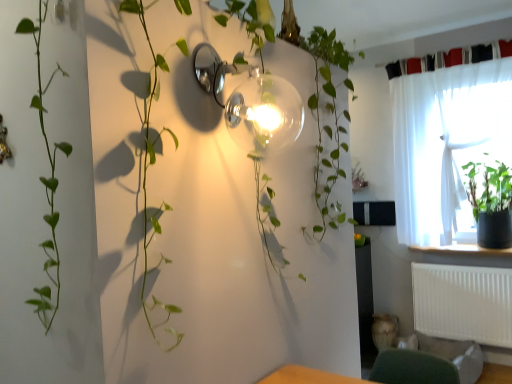
Question: Would you say black fabric curtain at upper right, which ranks as the second curtain in bottom-to-top order, is outside white sheer curtain at upper right, which is the 1th curtain from bottom to top?

Choices:
 (A) yes
 (B) no

Answer: (B)

Question: Considering the relative sizes of black fabric curtain at upper right, which ranks as the second curtain in bottom-to-top order, and white sheer curtain at upper right, which is the 1th curtain from bottom to top, in the image provided, is black fabric curtain at upper right, which ranks as the second curtain in bottom-to-top order, taller than white sheer curtain at upper right, which is the 1th curtain from bottom to top,?

Choices:
 (A) no
 (B) yes

Answer: (A)

Question: Is black fabric curtain at upper right, which ranks as the second curtain in bottom-to-top order, in front of white sheer curtain at upper right, which ranks as the 2th curtain in top-to-bottom order?

Choices:
 (A) yes
 (B) no

Answer: (B)

Question: Considering the relative sizes of black fabric curtain at upper right, which is counted as the first curtain, starting from the top, and white sheer curtain at upper right, which ranks as the 2th curtain in top-to-bottom order, in the image provided, is black fabric curtain at upper right, which is counted as the first curtain, starting from the top, bigger than white sheer curtain at upper right, which ranks as the 2th curtain in top-to-bottom order,?

Choices:
 (A) no
 (B) yes

Answer: (A)

Question: Does black fabric curtain at upper right, which is counted as the first curtain, starting from the top, appear on the right side of white sheer curtain at upper right, which ranks as the 2th curtain in top-to-bottom order?

Choices:
 (A) no
 (B) yes

Answer: (A)

Question: From a real-world perspective, is white sheer curtain at upper right, which ranks as the 2th curtain in top-to-bottom order, physically located above or below clear glass globe at upper center?

Choices:
 (A) above
 (B) below

Answer: (B)

Question: Relative to clear glass globe at upper center, is white sheer curtain at upper right, which ranks as the 2th curtain in top-to-bottom order, in front or behind?

Choices:
 (A) behind
 (B) front

Answer: (A)

Question: Considering the positions of white sheer curtain at upper right, which ranks as the 2th curtain in top-to-bottom order, and clear glass globe at upper center in the image, is white sheer curtain at upper right, which ranks as the 2th curtain in top-to-bottom order, wider or thinner than clear glass globe at upper center?

Choices:
 (A) thin
 (B) wide

Answer: (A)

Question: In the image, is white sheer curtain at upper right, which is the 1th curtain from bottom to top, on the left side or the right side of clear glass globe at upper center?

Choices:
 (A) right
 (B) left

Answer: (A)

Question: Is white sheer curtain at upper right, which ranks as the 2th curtain in top-to-bottom order, bigger or smaller than green fabric swivel chair at lower right?

Choices:
 (A) small
 (B) big

Answer: (B)

Question: From the image's perspective, is white sheer curtain at upper right, which ranks as the 2th curtain in top-to-bottom order, above or below green fabric swivel chair at lower right?

Choices:
 (A) below
 (B) above

Answer: (B)

Question: Visually, is white sheer curtain at upper right, which ranks as the 2th curtain in top-to-bottom order, positioned to the left or to the right of green fabric swivel chair at lower right?

Choices:
 (A) right
 (B) left

Answer: (A)

Question: Is white sheer curtain at upper right, which ranks as the 2th curtain in top-to-bottom order, wider or thinner than green fabric swivel chair at lower right?

Choices:
 (A) wide
 (B) thin

Answer: (B)

Question: Is black fabric curtain at upper right, which is counted as the first curtain, starting from the top, bigger or smaller than white glossy window sill at right?

Choices:
 (A) big
 (B) small

Answer: (B)

Question: Is point (457, 54) closer or farther from the camera than point (499, 253)?

Choices:
 (A) farther
 (B) closer

Answer: (A)